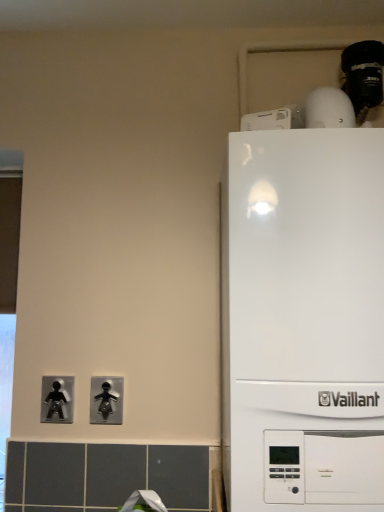
Question: Which direction should I rotate to face black plastic light switch at lower center, which is the first light switch in right-to-left order, — up or down?

Choices:
 (A) down
 (B) up

Answer: (A)

Question: From a real-world perspective, is metallic silver figure at lower left, arranged as the 2th light switch when viewed from the right, on white glossy boiler at right?

Choices:
 (A) yes
 (B) no

Answer: (B)

Question: From the image's perspective, does metallic silver figure at lower left, arranged as the 2th light switch when viewed from the right, appear higher than white glossy boiler at right?

Choices:
 (A) yes
 (B) no

Answer: (B)

Question: Considering the relative positions of metallic silver figure at lower left, which is the 1th light switch in left-to-right order, and white glossy boiler at right in the image provided, is metallic silver figure at lower left, which is the 1th light switch in left-to-right order, to the right of white glossy boiler at right from the viewer's perspective?

Choices:
 (A) no
 (B) yes

Answer: (A)

Question: From the image's perspective, is metallic silver figure at lower left, which is the 1th light switch in left-to-right order, under white glossy boiler at right?

Choices:
 (A) yes
 (B) no

Answer: (A)

Question: Can you confirm if metallic silver figure at lower left, arranged as the 2th light switch when viewed from the right, is shorter than white glossy boiler at right?

Choices:
 (A) no
 (B) yes

Answer: (B)

Question: Is metallic silver figure at lower left, arranged as the 2th light switch when viewed from the right, completely or partially outside of white glossy boiler at right?

Choices:
 (A) yes
 (B) no

Answer: (A)

Question: Is metallic silver figure at lower left, arranged as the 2th light switch when viewed from the right, inside black plastic light switch at lower center, which is the first light switch in right-to-left order?

Choices:
 (A) yes
 (B) no

Answer: (B)

Question: From a real-world perspective, is black plastic light switch at lower center, which is the first light switch in right-to-left order, over metallic silver figure at lower left, arranged as the 2th light switch when viewed from the right?

Choices:
 (A) yes
 (B) no

Answer: (B)

Question: Can you confirm if black plastic light switch at lower center, which is the first light switch in right-to-left order, is smaller than metallic silver figure at lower left, arranged as the 2th light switch when viewed from the right?

Choices:
 (A) no
 (B) yes

Answer: (B)

Question: Is black plastic light switch at lower center, which is the first light switch in right-to-left order, looking in the opposite direction of metallic silver figure at lower left, which is the 1th light switch in left-to-right order?

Choices:
 (A) no
 (B) yes

Answer: (A)

Question: From a real-world perspective, is black plastic light switch at lower center, which is the first light switch in right-to-left order, under metallic silver figure at lower left, which is the 1th light switch in left-to-right order?

Choices:
 (A) yes
 (B) no

Answer: (A)

Question: Is black plastic light switch at lower center, which is the first light switch in right-to-left order, positioned far away from metallic silver figure at lower left, arranged as the 2th light switch when viewed from the right?

Choices:
 (A) no
 (B) yes

Answer: (A)

Question: Does black plastic light switch at lower center, which is the first light switch in right-to-left order, turn towards white glossy boiler at right?

Choices:
 (A) yes
 (B) no

Answer: (B)